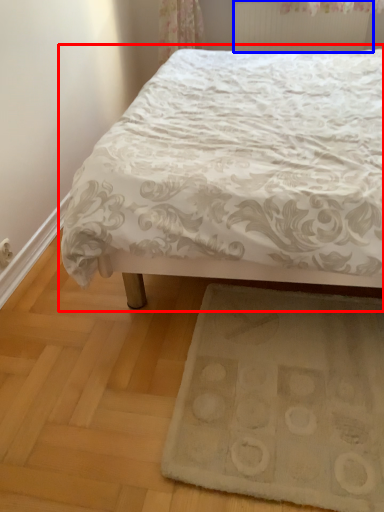
Question: Which point is closer to the camera, bed (highlighted by a red box) or radiator (highlighted by a blue box)?

Choices:
 (A) bed
 (B) radiator

Answer: (A)